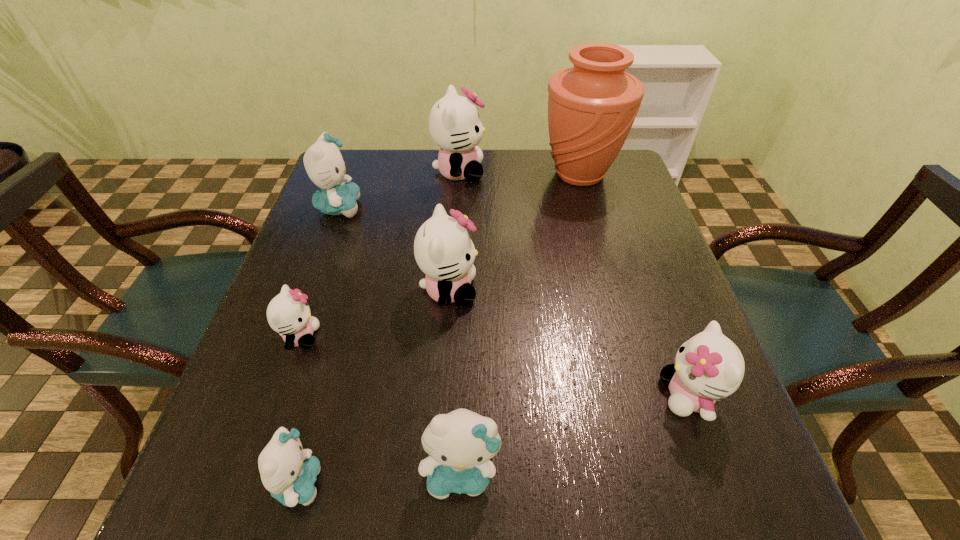
Find the location of `vase positioned at the far edge`. vase positioned at the far edge is located at coordinates click(x=592, y=106).

At what (x,y) coordinates should I click in order to perform the action: click on vase present at the right edge. Please return your answer as a coordinate pair (x, y). This screenshot has width=960, height=540. Looking at the image, I should click on (592, 106).

Where is `kitten located at the right edge`? kitten located at the right edge is located at coordinates (708, 366).

The image size is (960, 540). I want to click on object that is at the far left corner, so pos(324,164).

Identify the location of object that is at the near left corner. (288, 472).

Image resolution: width=960 pixels, height=540 pixels. What are the coordinates of `object at the far right corner` in the screenshot? It's located at [592, 106].

Find the location of a particular element. The width and height of the screenshot is (960, 540). free space at the far edge is located at coordinates (549, 185).

What are the coordinates of `vacant space at the near edge of the desktop` in the screenshot? It's located at (318, 522).

Locate an element on the screen. vacant area at the left edge of the desktop is located at coordinates (261, 400).

This screenshot has height=540, width=960. I want to click on vacant space at the right edge, so click(x=611, y=248).